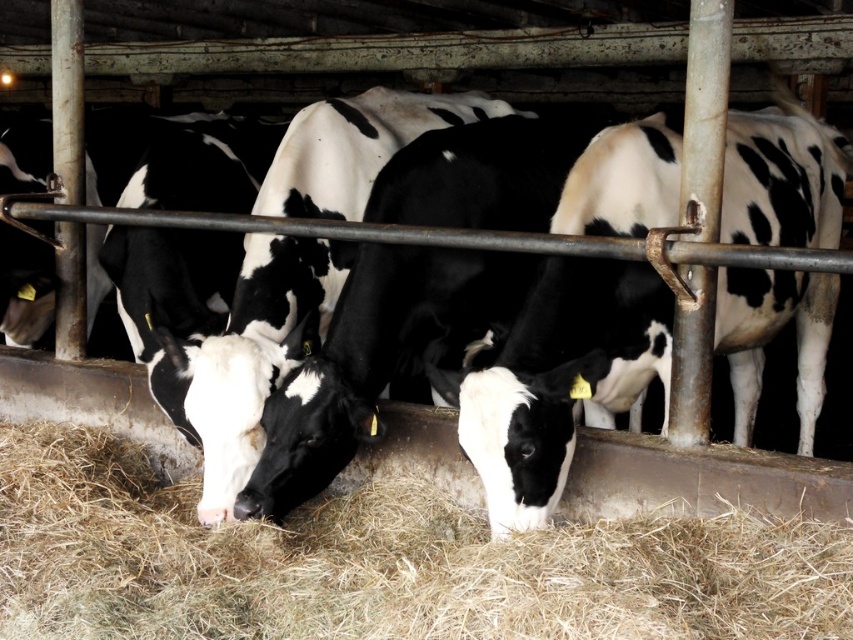
You are a farmer checking the feeding area of the barn. You notice the brown dry hay at center and the black and white cow at center. Which object is closer to you as you stand at the entrance?

The brown dry hay at center is closer to you because it is in front of the black and white cow at center.

You are a farmer checking the feeding area of the barn. You notice the brown dry hay at center and the black and white cow at center. Which object is located below the other?

The brown dry hay at center is positioned under the black and white cow at center, so the hay is below the cow.